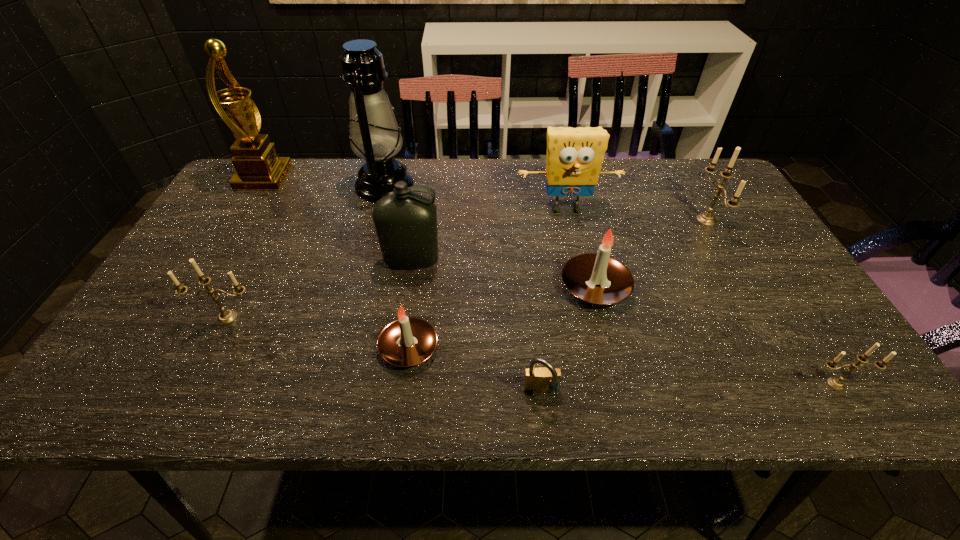
Find the location of a particular element. The height and width of the screenshot is (540, 960). vacant point located 0.310m on the right of the right white candle is located at coordinates click(x=760, y=287).

Identify the location of vacant position located 0.390m on the back of the second biggest metallic candle. (284, 206).

You are a GUI agent. You are given a task and a screenshot of the screen. Output one action in this format:
    pyautogui.click(x=<x>, y=<y>)
    Task: Click on the vacant space situated 0.200m on the back of the nearer white candle
    This screenshot has height=540, width=960.
    Given the screenshot: What is the action you would take?
    pyautogui.click(x=420, y=261)

I want to click on blank space located on the back of the nearest candle, so click(762, 268).

At what (x,y) coordinates should I click in order to perform the action: click on oil lamp located at the far edge. Please return your answer as a coordinate pair (x, y). This screenshot has width=960, height=540. Looking at the image, I should click on (374, 134).

What are the coordinates of `award that is at the far edge` in the screenshot? It's located at (258, 167).

The width and height of the screenshot is (960, 540). I want to click on sponge that is at the far edge, so click(574, 159).

The image size is (960, 540). I want to click on candle that is at the far edge, so click(707, 219).

You are a GUI agent. You are given a task and a screenshot of the screen. Output one action in this format:
    pyautogui.click(x=<x>, y=<y>)
    Task: Click on the padlock present at the near edge
    The image size is (960, 540).
    Given the screenshot: What is the action you would take?
    pyautogui.click(x=537, y=380)

The height and width of the screenshot is (540, 960). What are the coordinates of `award located in the left edge section of the desktop` in the screenshot? It's located at (258, 167).